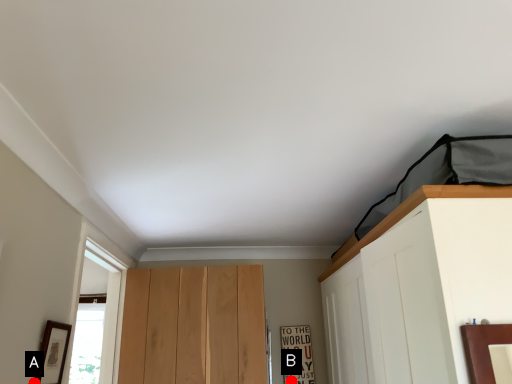
Question: Two points are circled on the image, labeled by A and B beside each circle. Which point is closer to the camera?

Choices:
 (A) A is closer
 (B) B is closer

Answer: (A)